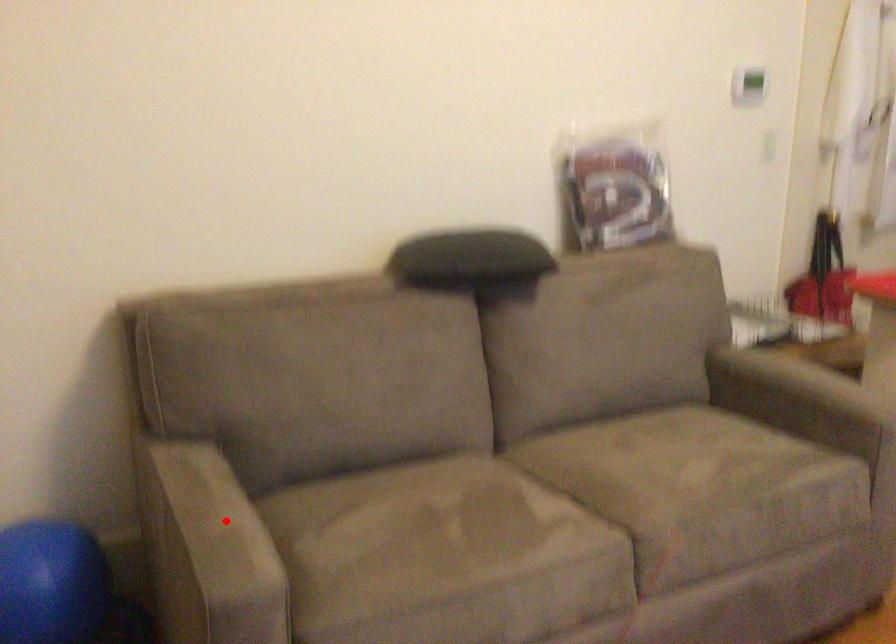
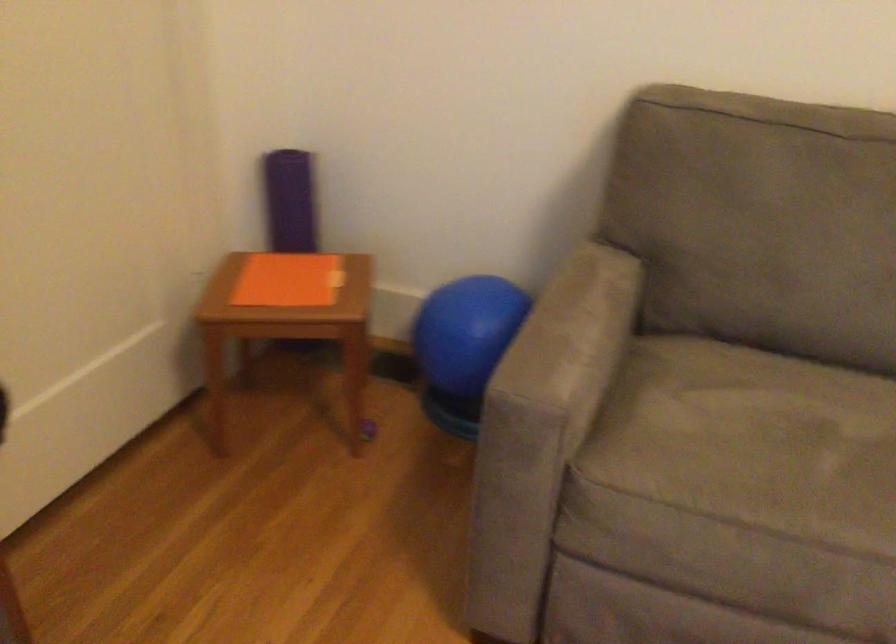
Locate, in the second image, the point that corresponds to the highlighted location in the first image.

(572, 333)